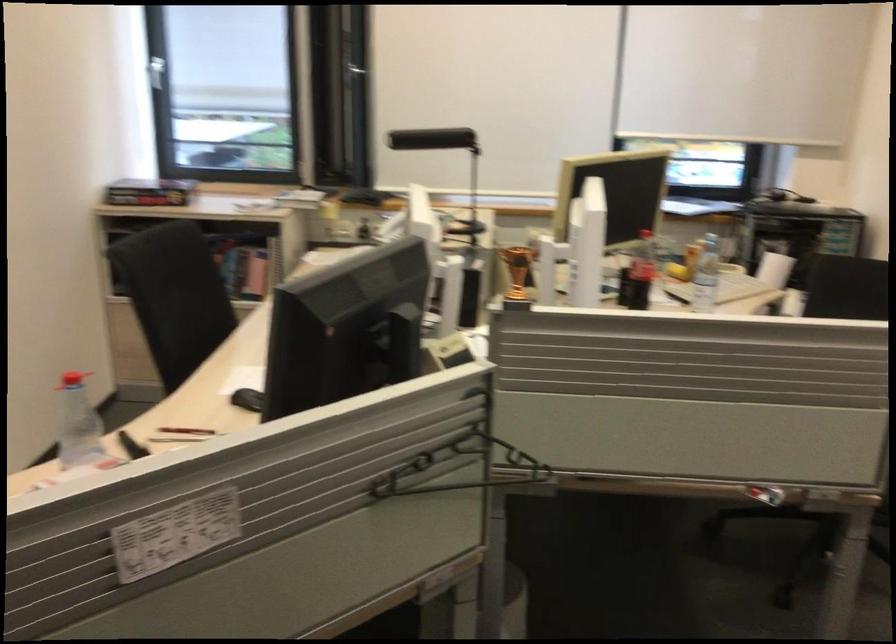
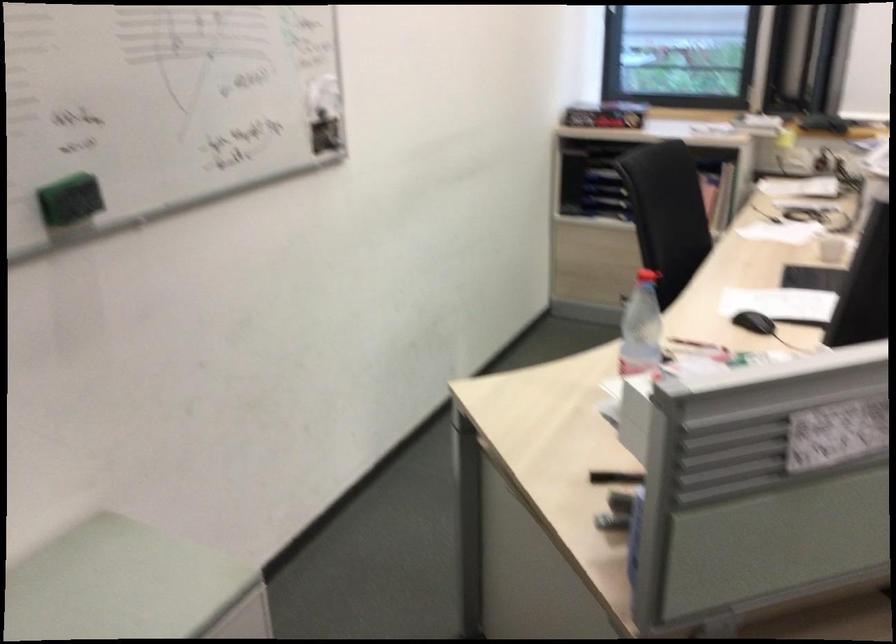
Question: Which direction would the cameraman need to move to produce the second image? Reply with the corresponding letter.

Choices:
 (A) Left
 (B) Right
 (C) Forward
 (D) Backward

Answer: (A)